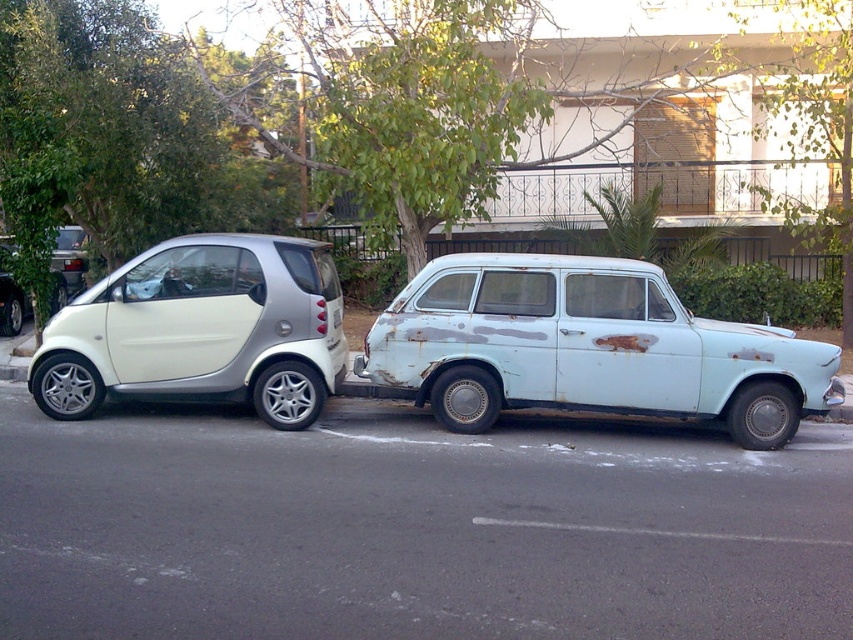
From the picture: You are a delivery person trying to park your van between the two cars. The rusty metal car at right is lower than the metallic silver car at left. Can you safely park your van in the space between them without hitting the lower car?

The rusty metal car at right is located below the metallic silver car at left, so parking between them may be risky. Ensure there is enough vertical clearance for your van before proceeding.

You are a delivery driver who needs to park your delivery van between the two cars. The van is 2 meters wide. Can you fit it between the rusty metal car at right and the metallic silver car at left?

The rusty metal car at right is positioned on the right side of the metallic silver car at left. Since the distance between them is not specified, it is impossible to determine if the van can fit.